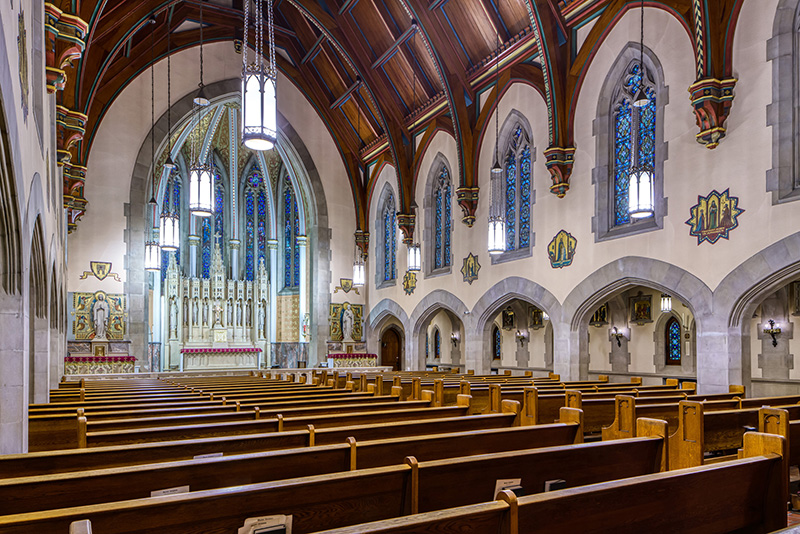
Locate an element on the screen. This screenshot has height=534, width=800. altar is located at coordinates (224, 350).